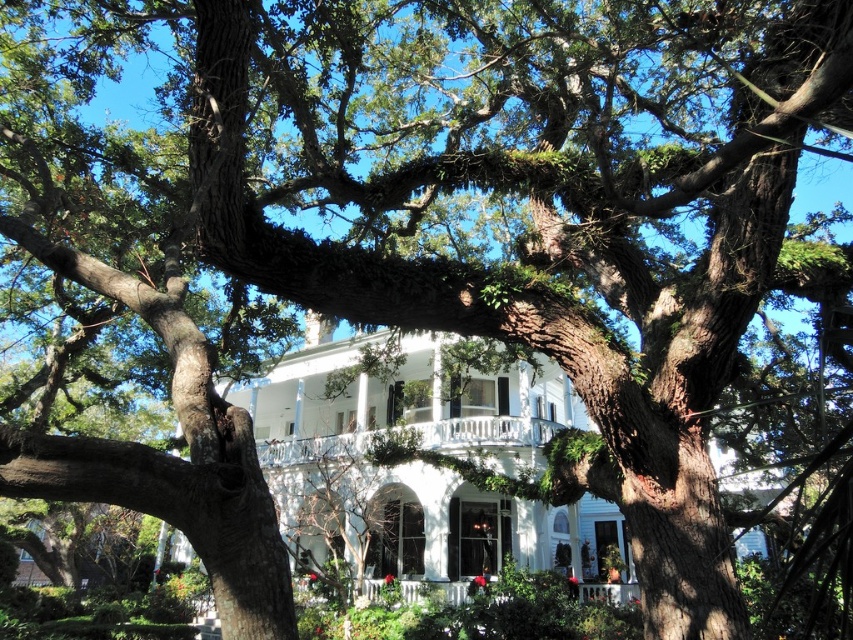
You are a delivery person trying to reach the front door of the white glossy mansion at center. You are currently standing on the white painted wood porch at center. Which direction should you move to reach the mansion?

Since the white glossy mansion at center is located above the white painted wood porch at center, you should move upward to reach the mansion from the porch.

You are standing in the garden of the house and want to take a photo of both the white glossy mansion at center and the white wooden porch at center. Since you want both in the frame, which object should you position closer to the camera to include both?

To include both the white glossy mansion at center and the white wooden porch at center in the frame, position the white glossy mansion at center closer to the camera since it is to the left of the white wooden porch at center.

You are standing in the garden looking at the house. The white glossy mansion at center and the white painted wood porch at center are both visible. Which one is positioned more to the right side?

The white glossy mansion at center is positioned more to the right side than the white painted wood porch at center.